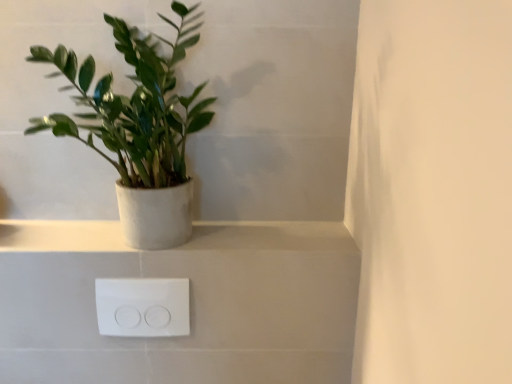
Question: Is white matte/porcelain shelf at upper center in front of green matte plant at left?

Choices:
 (A) no
 (B) yes

Answer: (A)

Question: From a real-world perspective, does white matte/porcelain shelf at upper center sit lower than green matte plant at left?

Choices:
 (A) no
 (B) yes

Answer: (B)

Question: From a real-world perspective, is white matte/porcelain shelf at upper center on green matte plant at left?

Choices:
 (A) yes
 (B) no

Answer: (B)

Question: Considering the relative sizes of white matte/porcelain shelf at upper center and green matte plant at left in the image provided, is white matte/porcelain shelf at upper center wider than green matte plant at left?

Choices:
 (A) yes
 (B) no

Answer: (B)

Question: Is white matte/porcelain shelf at upper center outside of green matte plant at left?

Choices:
 (A) yes
 (B) no

Answer: (A)

Question: Is green matte plant at left wider or thinner than white plastic outlet at lower center?

Choices:
 (A) thin
 (B) wide

Answer: (B)

Question: From the image's perspective, relative to white plastic outlet at lower center, is green matte plant at left above or below?

Choices:
 (A) below
 (B) above

Answer: (B)

Question: Would you say green matte plant at left is inside or outside white plastic outlet at lower center?

Choices:
 (A) inside
 (B) outside

Answer: (B)

Question: From a real-world perspective, is green matte plant at left above or below white plastic outlet at lower center?

Choices:
 (A) below
 (B) above

Answer: (B)

Question: Is point [153, 301] closer or farther from the camera than point [138, 216]?

Choices:
 (A) closer
 (B) farther

Answer: (B)

Question: In terms of height, does white plastic outlet at lower center look taller or shorter compared to green matte plant at left?

Choices:
 (A) short
 (B) tall

Answer: (A)

Question: In terms of width, does white plastic outlet at lower center look wider or thinner when compared to green matte plant at left?

Choices:
 (A) thin
 (B) wide

Answer: (A)

Question: In the image, is white plastic outlet at lower center on the left side or the right side of green matte plant at left?

Choices:
 (A) right
 (B) left

Answer: (A)

Question: In terms of height, does white matte/porcelain shelf at upper center look taller or shorter compared to white plastic outlet at lower center?

Choices:
 (A) short
 (B) tall

Answer: (A)

Question: Visually, is white matte/porcelain shelf at upper center positioned to the left or to the right of white plastic outlet at lower center?

Choices:
 (A) right
 (B) left

Answer: (A)